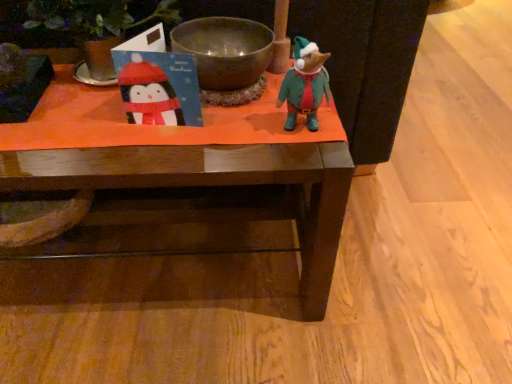
You are a GUI agent. You are given a task and a screenshot of the screen. Output one action in this format:
    pyautogui.click(x=<x>, y=<y>)
    Task: Click on the shiny metallic bowl at center
    
    Given the screenshot: What is the action you would take?
    pyautogui.click(x=225, y=50)

Find the location of a particular element. This screenshot has width=512, height=384. green felt mouse at center is located at coordinates (305, 84).

Between green felt mouse at center and shiny metallic bowl at center, which one has smaller size?

green felt mouse at center is smaller.

Which object is thinner, green felt mouse at center or shiny metallic bowl at center?

With smaller width is green felt mouse at center.

Which point is more distant from viewer, (307, 100) or (234, 33)?

The point (234, 33) is behind.

Considering the relative positions of green felt mouse at center and shiny metallic bowl at center in the image provided, is green felt mouse at center to the right of shiny metallic bowl at center from the viewer's perspective?

Yes.

Is shiny metallic bowl at center to the left of green felt mouse at center from the viewer's perspective?

Yes, shiny metallic bowl at center is to the left of green felt mouse at center.

Considering the positions of points (244, 76) and (300, 107), is point (244, 76) farther from camera compared to point (300, 107)?

That is True.

Would you say shiny metallic bowl at center is inside or outside green felt mouse at center?

shiny metallic bowl at center is not inside green felt mouse at center, it's outside.

From the picture: Is shiny metallic bowl at center far from green felt mouse at center?

Actually, shiny metallic bowl at center and green felt mouse at center are a little close together.

Is shiny metallic bowl at center to the left or to the right of wooden table at center in the image?

shiny metallic bowl at center is to the right of wooden table at center.

From a real-world perspective, is shiny metallic bowl at center below wooden table at center?

Incorrect, from a real-world perspective, shiny metallic bowl at center is higher than wooden table at center.

Is shiny metallic bowl at center oriented away from wooden table at center?

No, shiny metallic bowl at center is not facing the opposite direction of wooden table at center.

At what (x,y) coordinates should I click in order to perform the action: click on bowl that is on the right side of wooden table at center. Please return your answer as a coordinate pair (x, y). The width and height of the screenshot is (512, 384). Looking at the image, I should click on (225, 50).

From a real-world perspective, who is located higher, green felt mouse at center or wooden table at center?

From a 3D spatial view, green felt mouse at center is above.

Is green felt mouse at center turned away from wooden table at center?

No, green felt mouse at center's orientation is not away from wooden table at center.

Which object is thinner, green felt mouse at center or wooden table at center?

With smaller width is green felt mouse at center.

Measure the distance between green felt mouse at center and wooden table at center.

They are 11.59 inches apart.

Measure the distance between wooden table at center and shiny metallic bowl at center.

They are 10.36 inches apart.

Considering the positions of objects wooden table at center and shiny metallic bowl at center in the image provided, who is more to the left, wooden table at center or shiny metallic bowl at center?

From the viewer's perspective, wooden table at center appears more on the left side.

In terms of width, does wooden table at center look wider or thinner when compared to shiny metallic bowl at center?

wooden table at center is wider than shiny metallic bowl at center.

Considering the sizes of wooden table at center and shiny metallic bowl at center in the image, is wooden table at center taller or shorter than shiny metallic bowl at center?

wooden table at center is taller than shiny metallic bowl at center.

Can you tell me how much wooden table at center and green felt mouse at center differ in facing direction?

There is a 3.27-degree angle between the facing directions of wooden table at center and green felt mouse at center.

Does wooden table at center have a larger size compared to green felt mouse at center?

Yes, wooden table at center is bigger than green felt mouse at center.

Is the position of wooden table at center more distant than that of green felt mouse at center?

Yes, it is.

Is point (30, 161) positioned in front of point (298, 49)?

No, it is not.

The image size is (512, 384). I want to click on toy on the right of shiny metallic bowl at center, so click(x=305, y=84).

Where is `bowl that is on the left side of green felt mouse at center`? This screenshot has width=512, height=384. bowl that is on the left side of green felt mouse at center is located at coordinates (225, 50).

Considering their positions, is shiny metallic bowl at center positioned closer to green felt mouse at center than wooden table at center?

shiny metallic bowl at center lies closer to green felt mouse at center than the other object.

Estimate the real-world distances between objects in this image. Which object is closer to shiny metallic bowl at center, wooden table at center or green felt mouse at center?

The object closer to shiny metallic bowl at center is green felt mouse at center.

From the image, which object appears to be farther from green felt mouse at center, wooden table at center or shiny metallic bowl at center?

The object further to green felt mouse at center is wooden table at center.

From the image, which object appears to be farther from wooden table at center, green felt mouse at center or shiny metallic bowl at center?

Among the two, green felt mouse at center is located further to wooden table at center.

When comparing their distances from wooden table at center, does shiny metallic bowl at center or green felt mouse at center seem further?

The object further to wooden table at center is green felt mouse at center.

From the image, which object appears to be nearer to shiny metallic bowl at center, green felt mouse at center or wooden table at center?

Among the two, green felt mouse at center is located nearer to shiny metallic bowl at center.

Where is `bowl between wooden table at center and green felt mouse at center`? Image resolution: width=512 pixels, height=384 pixels. bowl between wooden table at center and green felt mouse at center is located at coordinates (225, 50).